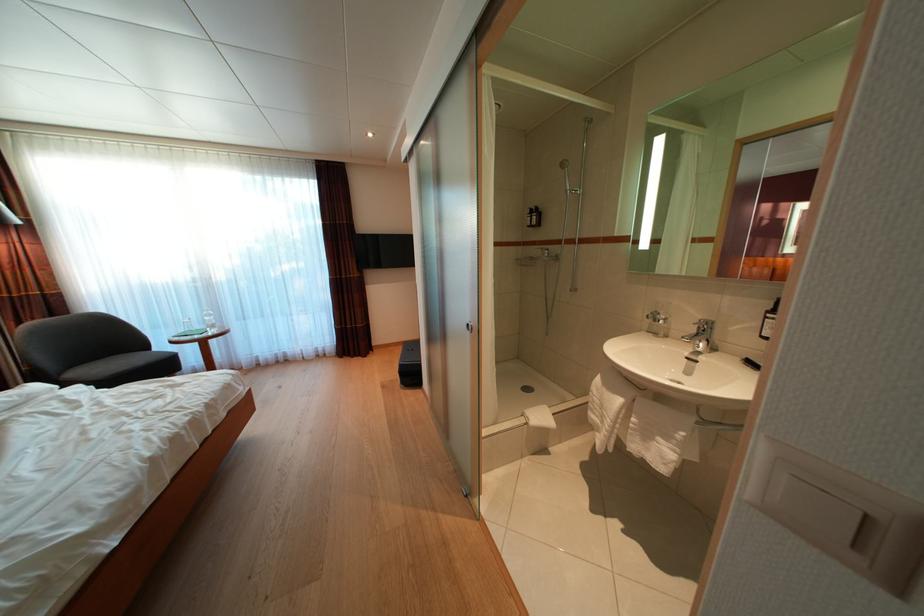
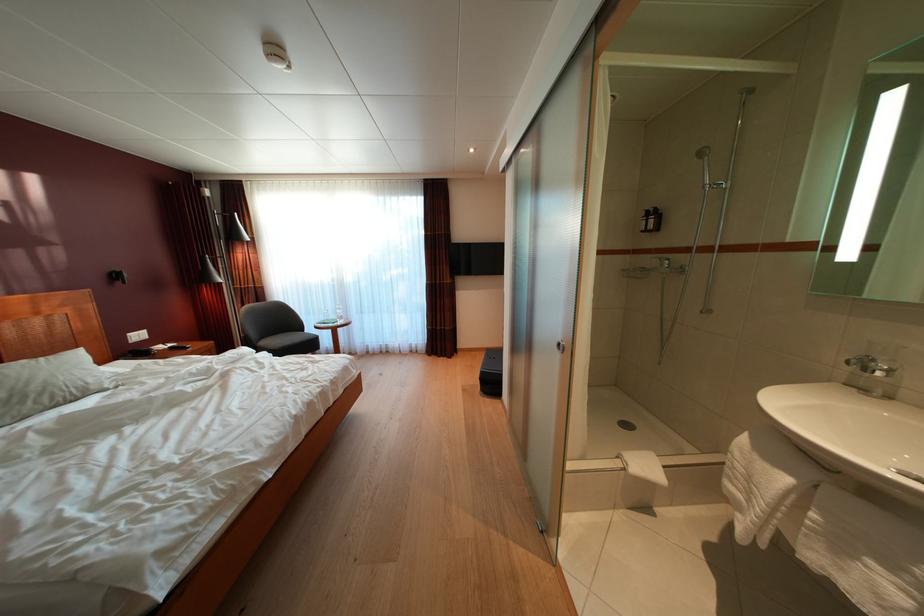
The point at (x=419, y=382) is marked in the first image. Where is the corresponding point in the second image?

(499, 391)